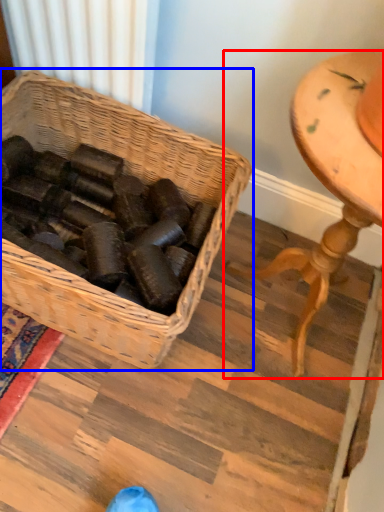
Question: Among these objects, which one is nearest to the camera, furniture (highlighted by a red box) or picnic basket (highlighted by a blue box)?

Choices:
 (A) furniture
 (B) picnic basket

Answer: (A)